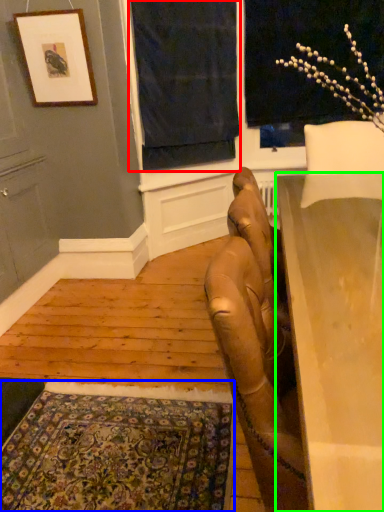
Question: Which is farther away from curtain (highlighted by a red box)? mat (highlighted by a blue box) or table (highlighted by a green box)?

Choices:
 (A) mat
 (B) table

Answer: (A)